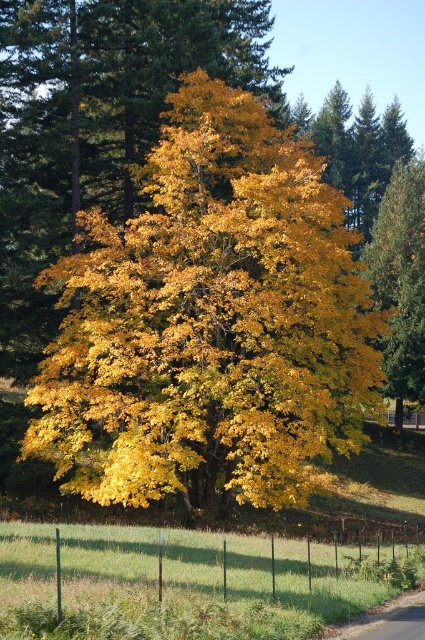
Question: Estimate the real-world distances between objects in this image. Which object is closer to the golden yellow leaves at center?

Choices:
 (A) yellow matte tree at right
 (B) green wire fence at lower center

Answer: (B)

Question: Is golden yellow leaves at center bigger than yellow matte tree at right?

Choices:
 (A) yes
 (B) no

Answer: (B)

Question: Is golden yellow leaves at center positioned at the back of yellow matte tree at right?

Choices:
 (A) no
 (B) yes

Answer: (A)

Question: Which of the following is the farthest from the observer?

Choices:
 (A) (178, 547)
 (B) (351, 348)

Answer: (B)

Question: Based on their relative distances, which object is nearer to the yellow matte tree at right?

Choices:
 (A) golden yellow leaves at center
 (B) green wire fence at lower center

Answer: (A)

Question: From the image, what is the correct spatial relationship of golden yellow leaves at center in relation to yellow matte tree at right?

Choices:
 (A) below
 (B) above

Answer: (A)